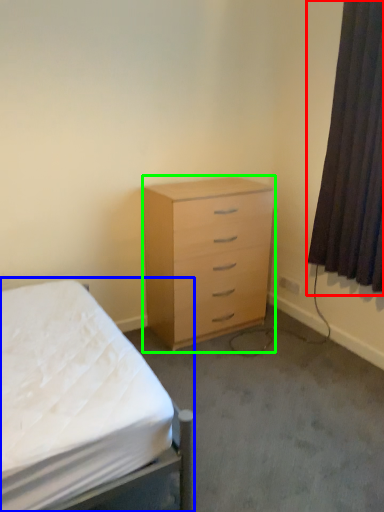
Question: Considering the real-world distances, which object is farthest from curtain (highlighted by a red box)? bed (highlighted by a blue box) or chest of drawers (highlighted by a green box)?

Choices:
 (A) bed
 (B) chest of drawers

Answer: (A)